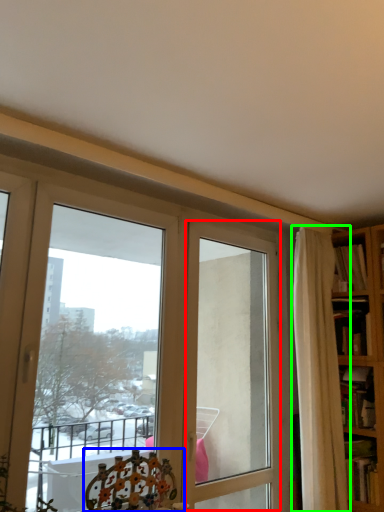
Question: Which object is the farthest from screen door (highlighted by a red box)? Choose among these: chair (highlighted by a blue box) or curtain (highlighted by a green box).

Choices:
 (A) chair
 (B) curtain

Answer: (A)